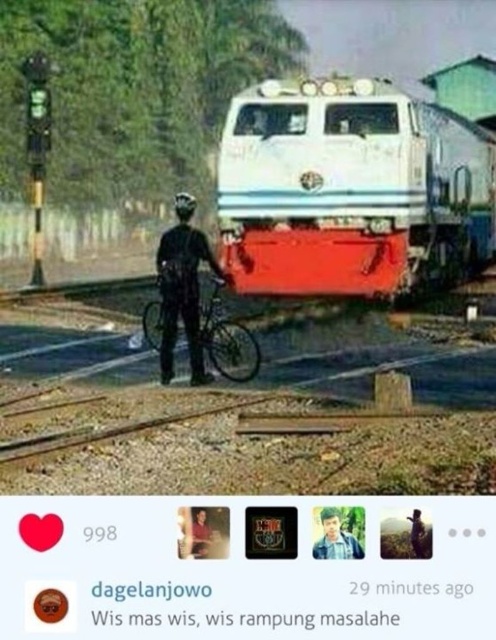
You are a safety inspector at the railway crossing. You notice a point marked at coordinates [435,118] in the image. According to the system, this point is 19.58 meters away from the camera. Given that the cyclist is standing in front of the train, do you think the cyclist is within the safe distance required to stop the train before it reaches them?

The point at coordinates [435,118] is 19.58 meters from the camera. Since the cyclist is positioned in front of the train and at this point, the distance may be insufficient for the train to stop safely, depending on its speed. However, without knowing the train speed or braking distance, it is impossible to confirm if the cyclist is within a safe distance.

You are a pedestrian at the railway crossing. You see a white glossy train at center and a black matte bicycle at center. Which object is closer to you?

The white glossy train at center is closer to you because the black matte bicycle at center is behind it.

You are a pedestrian at the railway crossing. You see the black matte bicycle at center and the blue shirt at center. Which object is taller?

The black matte bicycle at center is taller than the blue shirt at center.